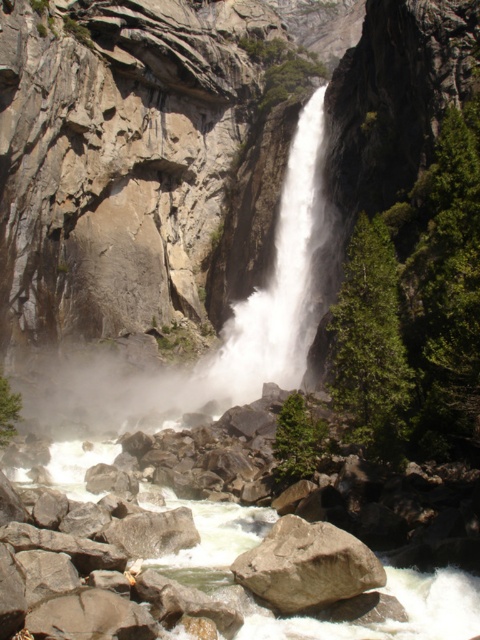
You are standing at the edge of the cliff overlooking the waterfall. You notice the white frothy water at center and the brown rough rock at center. Which one appears wider from your viewpoint?

The white frothy water at center appears wider than the brown rough rock at center because its width is larger according to the description.

You are standing at the edge of the cliff overlooking the waterfall. You notice a white frothy water at center. Can you determine its exact location using coordinates?

The white frothy water at center is located at coordinates point (212, 349).

You are standing at the edge of a cliff overlooking the waterfall and river. You see the white frothy water at center and the white smooth river at center. Which one is positioned to the right side of the other?

The white frothy water at center is to the right of the white smooth river at center.